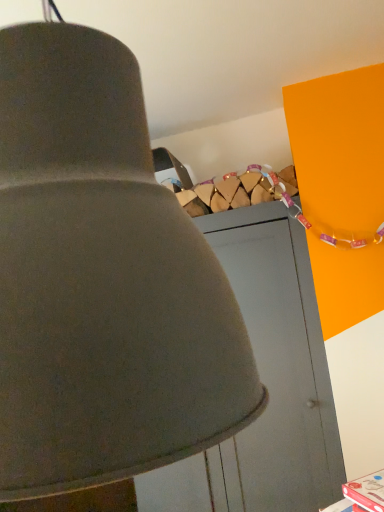
What is the approximate width of matte gray lampshade at upper left?

It is 15.09 inches.

This screenshot has width=384, height=512. Describe the element at coordinates (102, 281) in the screenshot. I see `matte gray lampshade at upper left` at that location.

At what (x,y) coordinates should I click in order to perform the action: click on matte gray lampshade at upper left. Please return your answer as a coordinate pair (x, y). Image resolution: width=384 pixels, height=512 pixels. Looking at the image, I should click on (102, 281).

The image size is (384, 512). I want to click on matte gray lampshade at upper left, so click(x=102, y=281).